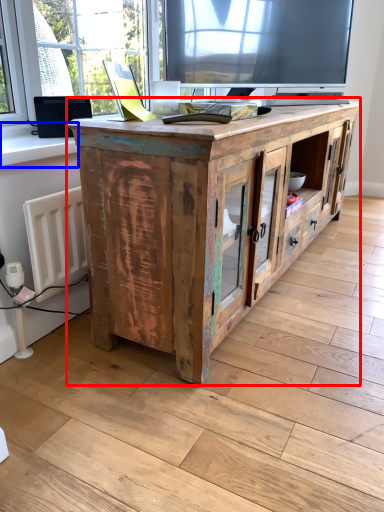
Question: Which object appears closest to the camera in this image, cabinetry (highlighted by a red box) or window sill (highlighted by a blue box)?

Choices:
 (A) cabinetry
 (B) window sill

Answer: (A)